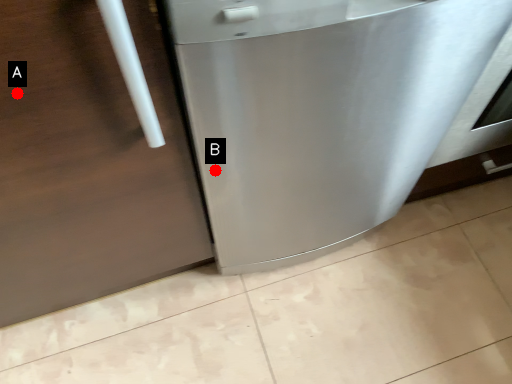
Question: Two points are circled on the image, labeled by A and B beside each circle. Among these points, which one is nearest to the camera?

Choices:
 (A) A is closer
 (B) B is closer

Answer: (A)